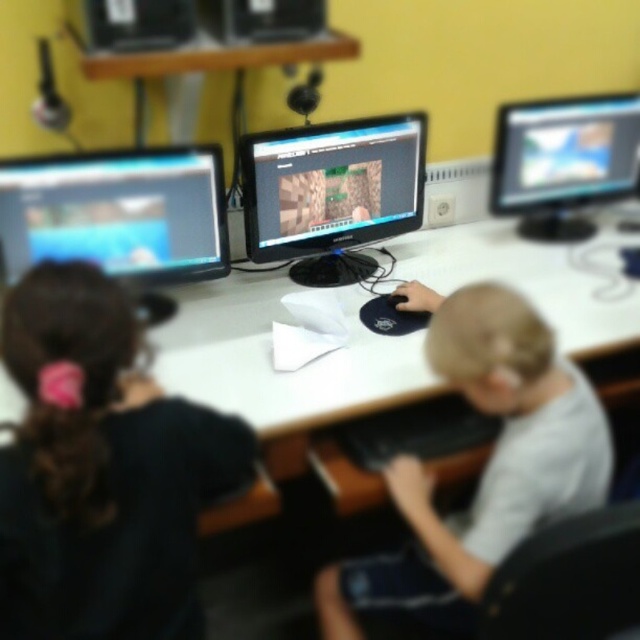
Which is more to the right, matte black monitor at center or matte black monitor at upper right?

Positioned to the right is matte black monitor at upper right.

Is point (317, 237) closer to viewer compared to point (628, 138)?

Yes, point (317, 237) is in front of point (628, 138).

Where is `matte black monitor at center`? This screenshot has height=640, width=640. matte black monitor at center is located at coordinates (332, 193).

From the picture: Between light gray shirt at center and matte black monitor at left, which one is positioned lower?

light gray shirt at center is lower down.

Is light gray shirt at center positioned behind matte black monitor at left?

No, light gray shirt at center is closer to the viewer.

What do you see at coordinates (486, 464) in the screenshot? I see `light gray shirt at center` at bounding box center [486, 464].

The height and width of the screenshot is (640, 640). Find the location of `light gray shirt at center`. light gray shirt at center is located at coordinates (486, 464).

The width and height of the screenshot is (640, 640). Describe the element at coordinates (282, 372) in the screenshot. I see `white glossy computer desk at center` at that location.

Can you confirm if white glossy computer desk at center is positioned to the left of matte black monitor at upper right?

Correct, you'll find white glossy computer desk at center to the left of matte black monitor at upper right.

Which is behind, point (198, 326) or point (580, 140)?

Point (580, 140)

At what (x,y) coordinates should I click in order to perform the action: click on white glossy computer desk at center. Please return your answer as a coordinate pair (x, y). This screenshot has height=640, width=640. Looking at the image, I should click on (282, 372).